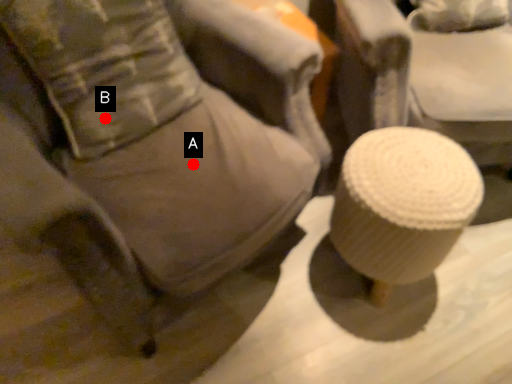
Question: Two points are circled on the image, labeled by A and B beside each circle. Among these points, which one is nearest to the camera?

Choices:
 (A) A is closer
 (B) B is closer

Answer: (A)